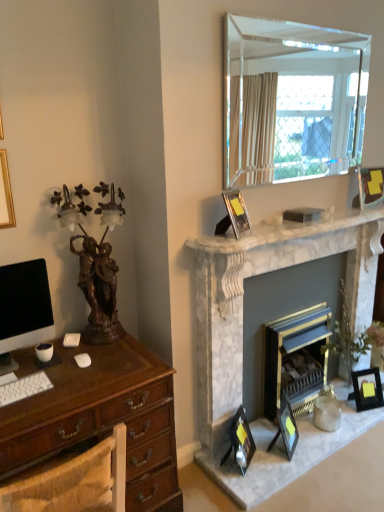
Where is `white marble fireplace at center, positioned as the 1th fireplace in left-to-right order`? The width and height of the screenshot is (384, 512). white marble fireplace at center, positioned as the 1th fireplace in left-to-right order is located at coordinates (258, 274).

What do you see at coordinates (101, 419) in the screenshot? This screenshot has height=512, width=384. I see `brown wood desk at lower left` at bounding box center [101, 419].

The image size is (384, 512). What do you see at coordinates (371, 187) in the screenshot?
I see `matte black picture frame at upper right, the 1th picture frame in the top-to-bottom sequence` at bounding box center [371, 187].

Image resolution: width=384 pixels, height=512 pixels. In order to click on matte black picture frame at upper right, acting as the first picture frame starting from the right in this screenshot , I will do `click(371, 187)`.

What do you see at coordinates (240, 441) in the screenshot? This screenshot has width=384, height=512. I see `matte black picture frame at lower right, placed as the first picture frame when sorted from bottom to top` at bounding box center [240, 441].

Where is `matte black picture frame at right, arranged as the third picture frame when viewed from the top`? Image resolution: width=384 pixels, height=512 pixels. matte black picture frame at right, arranged as the third picture frame when viewed from the top is located at coordinates (367, 389).

What do you see at coordinates (295, 359) in the screenshot?
I see `blue painted metal fireplace at center, which is the first fireplace in right-to-left order` at bounding box center [295, 359].

What do you see at coordinates (23, 309) in the screenshot?
I see `matte black monitor at left` at bounding box center [23, 309].

This screenshot has height=512, width=384. In order to click on white marble fireplace at center, positioned as the second fireplace in right-to-left order in this screenshot , I will do `click(258, 274)`.

From the image's perspective, does matte black picture frame at right, arranged as the third picture frame when viewed from the top, appear higher than silver metallic picture frame at upper center, marked as the 4th picture frame in a bottom-to-top arrangement?

No, from the image's perspective, matte black picture frame at right, arranged as the third picture frame when viewed from the top, is not on top of silver metallic picture frame at upper center, marked as the 4th picture frame in a bottom-to-top arrangement.

Locate an element on the screen. the 3rd picture frame to the left of the matte black picture frame at right, marked as the third picture frame in a bottom-to-top arrangement, counting from the anchor's position is located at coordinates (236, 212).

In the scene shown: Which is farther, (377,379) or (230,200)?

The point (377,379) is farther from the camera.

Is matte black picture frame at right, marked as the third picture frame in a bottom-to-top arrangement, wider or thinner than silver metallic picture frame at upper center, which is the 1th picture frame from left to right?

Clearly, matte black picture frame at right, marked as the third picture frame in a bottom-to-top arrangement, has more width compared to silver metallic picture frame at upper center, which is the 1th picture frame from left to right.

Identify the location of desk that is in front of the white marble fireplace at upper center. (101, 419).

Can you confirm if brown wood desk at lower left is bigger than white marble fireplace at upper center?

Yes, brown wood desk at lower left is bigger than white marble fireplace at upper center.

From a real-world perspective, is brown wood desk at lower left located higher than white marble fireplace at upper center?

No, from a real-world perspective, brown wood desk at lower left is not on top of white marble fireplace at upper center.

Is brown wood desk at lower left looking in the opposite direction of white marble fireplace at upper center?

No.

Is clear glass mirror at upper right positioned far away from brown wood desk at lower left?

Yes, clear glass mirror at upper right and brown wood desk at lower left are located far from each other.

Consider the image. Which is correct: clear glass mirror at upper right is inside brown wood desk at lower left, or outside of it?

clear glass mirror at upper right cannot be found inside brown wood desk at lower left.

How many degrees apart are the facing directions of clear glass mirror at upper right and brown wood desk at lower left?

178 degrees separate the facing orientations of clear glass mirror at upper right and brown wood desk at lower left.

From the image's perspective, is clear glass mirror at upper right on brown wood desk at lower left?

Yes.

Is matte black picture frame at lower center, which is the third picture frame in left-to-right order, completely or partially inside white marble fireplace at center, positioned as the 1th fireplace in left-to-right order?

Definitely not — matte black picture frame at lower center, which is the third picture frame in left-to-right order, is not inside white marble fireplace at center, positioned as the 1th fireplace in left-to-right order.

Considering the relative sizes of white marble fireplace at center, positioned as the second fireplace in right-to-left order, and matte black picture frame at lower center, which appears as the 2th picture frame when ordered from the bottom, in the image provided, is white marble fireplace at center, positioned as the second fireplace in right-to-left order, smaller than matte black picture frame at lower center, which appears as the 2th picture frame when ordered from the bottom,?

No.

Which object is positioned more to the left, white marble fireplace at center, positioned as the second fireplace in right-to-left order, or matte black picture frame at lower center, which appears as the 2th picture frame when ordered from the bottom?

Positioned to the left is matte black picture frame at lower center, which appears as the 2th picture frame when ordered from the bottom.

Can you tell me how much clear glass mirror at upper right and white marble fireplace at upper center differ in facing direction?

The angle between the facing direction of clear glass mirror at upper right and the facing direction of white marble fireplace at upper center is 0.653 degrees.

Is point (252, 19) positioned in front of point (333, 215)?

Yes, point (252, 19) is in front of point (333, 215).

In order to click on mirror lying on the left of white marble fireplace at upper center in this screenshot , I will do `click(292, 99)`.

In terms of height, does clear glass mirror at upper right look taller or shorter compared to white marble fireplace at upper center?

Considering their sizes, clear glass mirror at upper right has more height than white marble fireplace at upper center.

Looking at the image, does white marble fireplace at upper center seem bigger or smaller compared to white matte keyboard at lower left?

Clearly, white marble fireplace at upper center is larger in size than white matte keyboard at lower left.

In the scene shown: Would you say white matte keyboard at lower left is part of white marble fireplace at upper center's contents?

Actually, white matte keyboard at lower left is outside white marble fireplace at upper center.

Is white marble fireplace at upper center positioned in front of white matte keyboard at lower left?

No.

From the image's perspective, does white marble fireplace at upper center appear lower than white matte keyboard at lower left?

Incorrect, from the image's perspective, white marble fireplace at upper center is higher than white matte keyboard at lower left.

Is silver metallic picture frame at upper center, which is the 1th picture frame from left to right, oriented towards white marble fireplace at upper center?

No.

How many degrees apart are the facing directions of silver metallic picture frame at upper center, marked as the 4th picture frame in a bottom-to-top arrangement, and white marble fireplace at upper center?

The facing directions of silver metallic picture frame at upper center, marked as the 4th picture frame in a bottom-to-top arrangement, and white marble fireplace at upper center are 22.2 degrees apart.

In terms of size, does silver metallic picture frame at upper center, acting as the second picture frame starting from the top, appear bigger or smaller than white marble fireplace at upper center?

silver metallic picture frame at upper center, acting as the second picture frame starting from the top, is smaller than white marble fireplace at upper center.

Could you measure the distance between silver metallic picture frame at upper center, which is the 1th picture frame from left to right, and white marble fireplace at upper center?

silver metallic picture frame at upper center, which is the 1th picture frame from left to right, is 10.18 inches away from white marble fireplace at upper center.

Find the location of a particular element. picture frame that is the 3rd one below the silver metallic picture frame at upper center, marked as the 4th picture frame in a bottom-to-top arrangement (from a real-world perspective) is located at coordinates (367, 389).

Locate an element on the screen. The width and height of the screenshot is (384, 512). mantle above the brown wood desk at lower left (from a real-world perspective) is located at coordinates (284, 231).

Looking at the image, which one is located closer to white marble fireplace at center, positioned as the 1th fireplace in left-to-right order, matte black picture frame at upper right, the 1th picture frame in the top-to-bottom sequence, or matte black monitor at left?

Among the two, matte black picture frame at upper right, the 1th picture frame in the top-to-bottom sequence, is located nearer to white marble fireplace at center, positioned as the 1th fireplace in left-to-right order.

When comparing their distances from matte black picture frame at lower right, which ranks as the fifth picture frame in top-to-bottom order, does brown wood desk at lower left or matte black picture frame at lower center, which appears as the 2th picture frame when ordered from the bottom, seem further?

Based on the image, brown wood desk at lower left appears to be further to matte black picture frame at lower right, which ranks as the fifth picture frame in top-to-bottom order.

When comparing their distances from brown wood desk at lower left, does matte black picture frame at upper right, which is the fifth picture frame from left to right, or matte black monitor at left seem further?

The object further to brown wood desk at lower left is matte black picture frame at upper right, which is the fifth picture frame from left to right.

From the image, which object appears to be farther from white matte keyboard at lower left, matte black picture frame at lower center, which is the third picture frame in left-to-right order, or blue painted metal fireplace at center, which is the first fireplace in right-to-left order?

The object further to white matte keyboard at lower left is blue painted metal fireplace at center, which is the first fireplace in right-to-left order.

From the image, which object appears to be nearer to matte black picture frame at upper right, the 1th picture frame in the top-to-bottom sequence, blue painted metal fireplace at center, the 2th fireplace positioned from the left, or clear glass mirror at upper right?

Based on the image, clear glass mirror at upper right appears to be nearer to matte black picture frame at upper right, the 1th picture frame in the top-to-bottom sequence.

Looking at the image, which one is located closer to matte black picture frame at right, the 4th picture frame from the left, brown wood desk at lower left or white matte keyboard at lower left?

brown wood desk at lower left.

Estimate the real-world distances between objects in this image. Which object is closer to clear glass mirror at upper right, matte black picture frame at right, the 4th picture frame from the left, or white marble fireplace at upper center?

Among the two, white marble fireplace at upper center is located nearer to clear glass mirror at upper right.

Based on the photo, when comparing their distances from matte black picture frame at lower center, which appears as the 2th picture frame when ordered from the bottom, does matte black picture frame at lower right, placed as the first picture frame when sorted from bottom to top, or clear glass mirror at upper right seem closer?

matte black picture frame at lower right, placed as the first picture frame when sorted from bottom to top, is closer to matte black picture frame at lower center, which appears as the 2th picture frame when ordered from the bottom.

Where is `mirror located between silver metallic picture frame at upper center, marked as the 4th picture frame in a bottom-to-top arrangement, and matte black picture frame at upper right, the 1th picture frame in the top-to-bottom sequence, in the left-right direction`? This screenshot has width=384, height=512. mirror located between silver metallic picture frame at upper center, marked as the 4th picture frame in a bottom-to-top arrangement, and matte black picture frame at upper right, the 1th picture frame in the top-to-bottom sequence, in the left-right direction is located at coordinates (292, 99).

At what (x,y) coordinates should I click in order to perform the action: click on fireplace between brown wood desk at lower left and blue painted metal fireplace at center, which is the first fireplace in right-to-left order. Please return your answer as a coordinate pair (x, y). Looking at the image, I should click on (258, 274).

Where is `computer keyboard between matte black monitor at left and matte black picture frame at upper right, acting as the first picture frame starting from the right`? computer keyboard between matte black monitor at left and matte black picture frame at upper right, acting as the first picture frame starting from the right is located at coordinates (24, 388).

The height and width of the screenshot is (512, 384). What are the coordinates of `mantle between clear glass mirror at upper right and blue painted metal fireplace at center, which is the first fireplace in right-to-left order, vertically` in the screenshot? It's located at (284, 231).